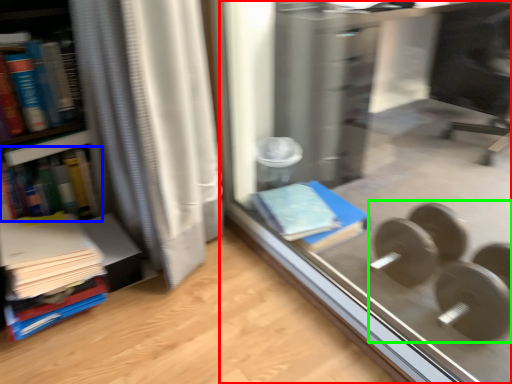
Question: Which object is positioned closest to glass door (highlighted by a red box)? Select from book (highlighted by a blue box) and dumbbell (highlighted by a green box).

Choices:
 (A) book
 (B) dumbbell

Answer: (B)